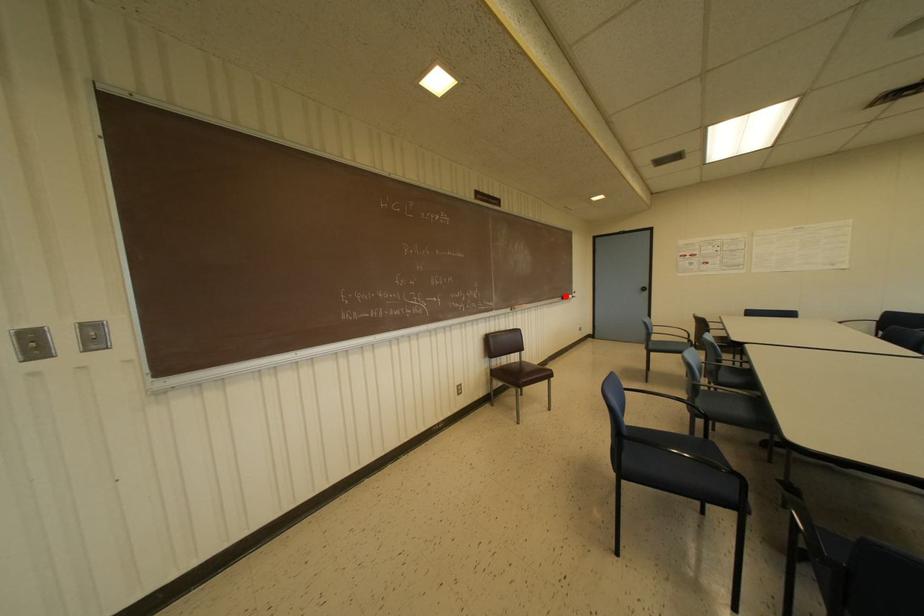
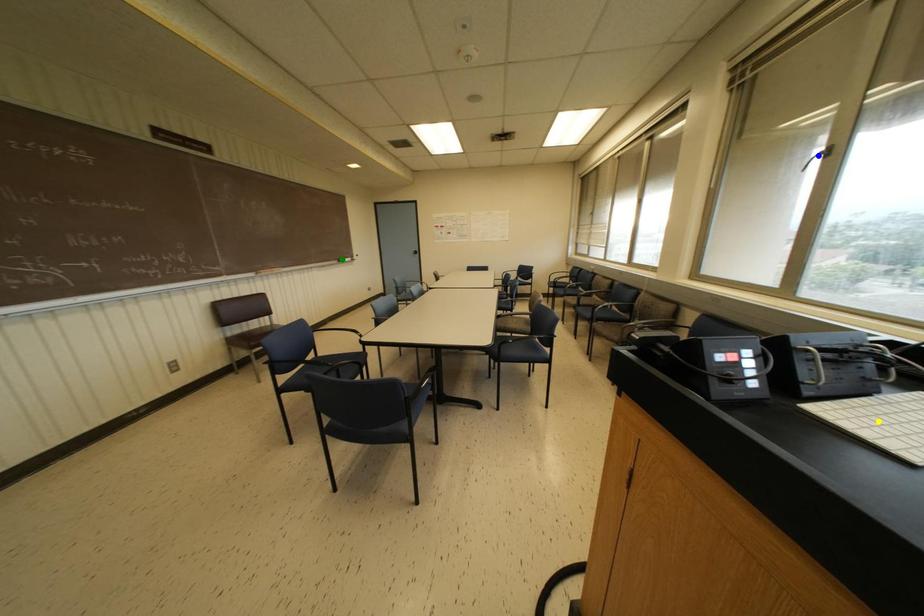
Question: I am providing you with two images of the same scene from different viewpoints. A red point is marked on the first image. You are given multiple points on the second image. In image 2, which mark is for the same physical point as the one in image 1?

Choices:
 (A) yellow point
 (B) blue point
 (C) green point

Answer: (C)